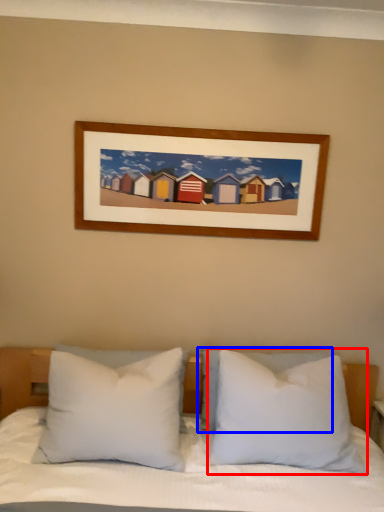
Question: Which object is closer to the camera taking this photo, pillow (highlighted by a red box) or pillow (highlighted by a blue box)?

Choices:
 (A) pillow
 (B) pillow

Answer: (A)